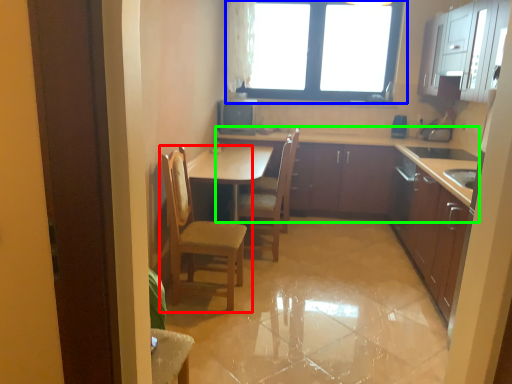
Question: Based on their relative distances, which object is nearer to chair (highlighted by a red box)? Choose from window (highlighted by a blue box) and cabinetry (highlighted by a green box).

Choices:
 (A) window
 (B) cabinetry

Answer: (B)